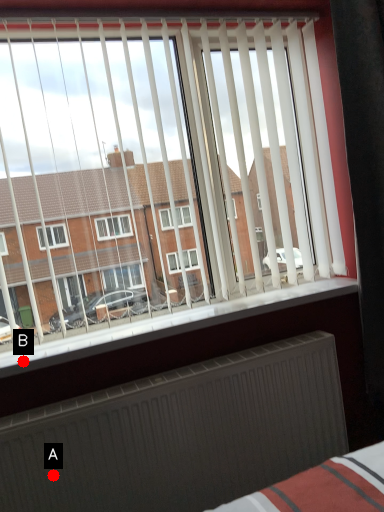
Question: Two points are circled on the image, labeled by A and B beside each circle. Which of the following is the closest to the observer?

Choices:
 (A) A is closer
 (B) B is closer

Answer: (A)